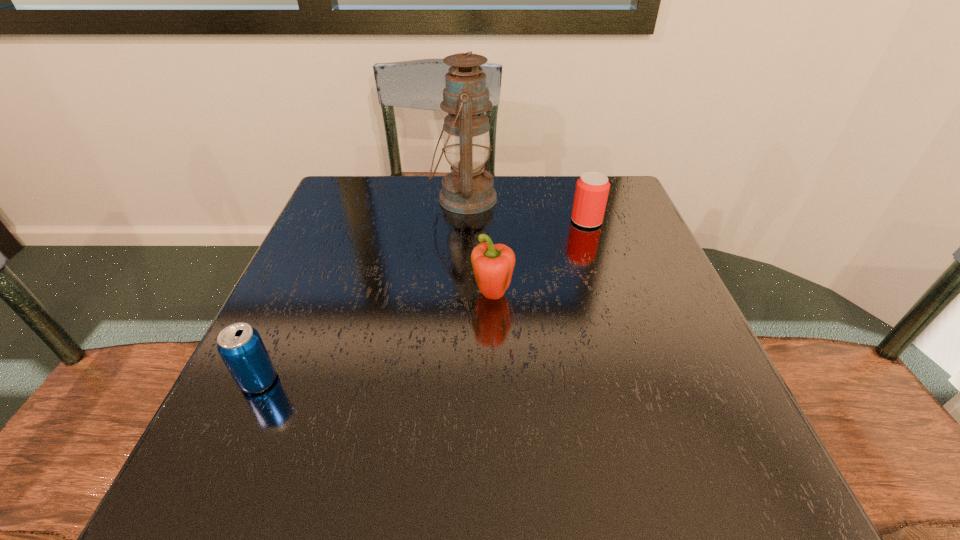
Image resolution: width=960 pixels, height=540 pixels. Identify the location of oil lamp located in the far edge section of the desktop. (469, 189).

This screenshot has height=540, width=960. I want to click on beer can that is at the far edge, so click(x=592, y=188).

I want to click on object located at the left edge, so click(240, 346).

The width and height of the screenshot is (960, 540). Identify the location of object positioned at the right edge. (592, 188).

The image size is (960, 540). I want to click on object located at the far right corner, so click(592, 188).

In the image, there is a desktop. Identify the location of vacant space at the far edge. (526, 194).

Locate an element on the screen. The width and height of the screenshot is (960, 540). vacant area at the near edge of the desktop is located at coordinates (623, 469).

The height and width of the screenshot is (540, 960). Identify the location of vacant point at the left edge. 236,413.

In the image, there is a desktop. Where is `vacant region at the right edge`? The image size is (960, 540). vacant region at the right edge is located at coordinates (641, 334).

In the image, there is a desktop. Identify the location of vacant space at the far right corner. The image size is (960, 540). (573, 202).